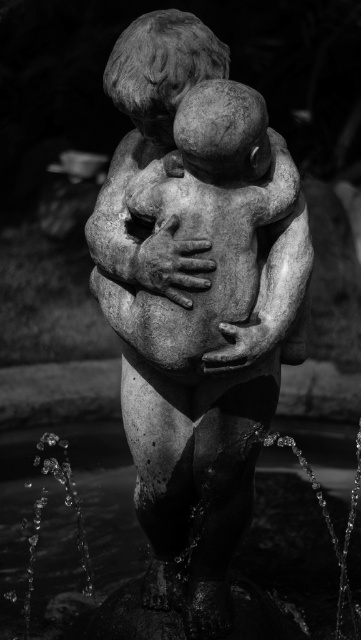
Does stone statue at center have a lesser height compared to sparkling water at statue center?

In fact, stone statue at center may be taller than sparkling water at statue center.

Can you confirm if stone statue at center is positioned above sparkling water at statue center?

Yes, stone statue at center is above sparkling water at statue center.

Which is in front, point (232, 106) or point (164, 632)?

Point (232, 106)

Find the location of a particular element. This screenshot has height=640, width=361. stone statue at center is located at coordinates (196, 298).